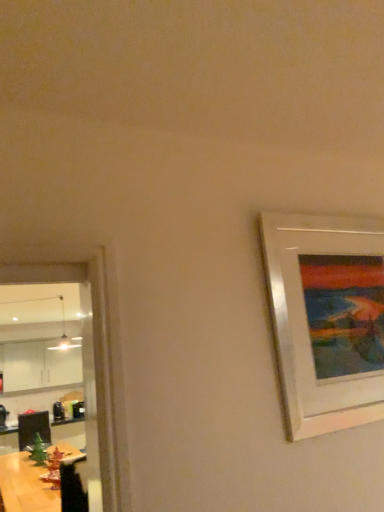
Question: Does white glossy picture frame at right appear on the right side of wooden table at lower left?

Choices:
 (A) yes
 (B) no

Answer: (A)

Question: Considering the relative sizes of white glossy picture frame at right and wooden table at lower left in the image provided, is white glossy picture frame at right taller than wooden table at lower left?

Choices:
 (A) no
 (B) yes

Answer: (B)

Question: Is the position of white glossy picture frame at right more distant than that of wooden table at lower left?

Choices:
 (A) no
 (B) yes

Answer: (A)

Question: From a real-world perspective, is white glossy picture frame at right on wooden table at lower left?

Choices:
 (A) no
 (B) yes

Answer: (B)

Question: From the image's perspective, does white glossy picture frame at right appear higher than wooden table at lower left?

Choices:
 (A) no
 (B) yes

Answer: (B)

Question: Could you tell me if white glossy picture frame at right is turned towards wooden table at lower left?

Choices:
 (A) no
 (B) yes

Answer: (A)

Question: Does wooden table at lower left turn towards white glossy picture frame at right?

Choices:
 (A) no
 (B) yes

Answer: (A)

Question: Considering the relative sizes of wooden table at lower left and white glossy picture frame at right in the image provided, is wooden table at lower left taller than white glossy picture frame at right?

Choices:
 (A) no
 (B) yes

Answer: (A)

Question: Does wooden table at lower left have a lesser width compared to white glossy picture frame at right?

Choices:
 (A) yes
 (B) no

Answer: (B)

Question: Can you confirm if wooden table at lower left is wider than white glossy picture frame at right?

Choices:
 (A) no
 (B) yes

Answer: (B)

Question: Can you confirm if wooden table at lower left is shorter than white glossy picture frame at right?

Choices:
 (A) no
 (B) yes

Answer: (B)

Question: Is wooden table at lower left bigger than white glossy picture frame at right?

Choices:
 (A) yes
 (B) no

Answer: (A)

Question: Is white glossy picture frame at right in front of or behind wooden table at lower left in the image?

Choices:
 (A) behind
 (B) front

Answer: (B)